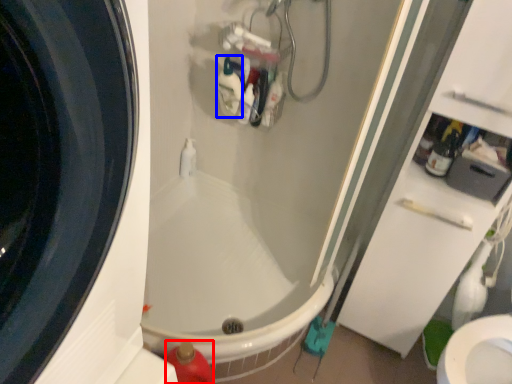
Question: Among these objects, which one is farthest to the camera, cleaning product (highlighted by a red box) or cleaning product (highlighted by a blue box)?

Choices:
 (A) cleaning product
 (B) cleaning product

Answer: (B)